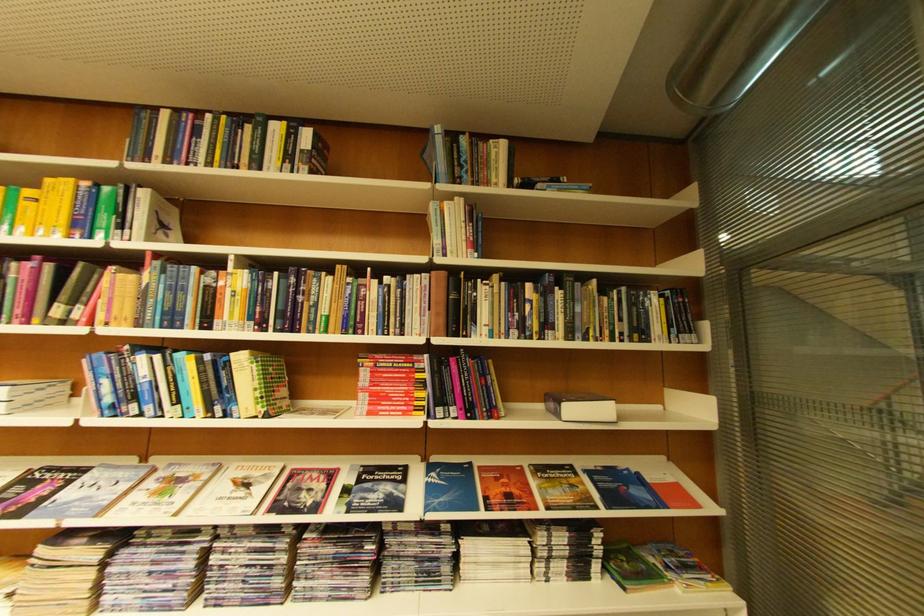
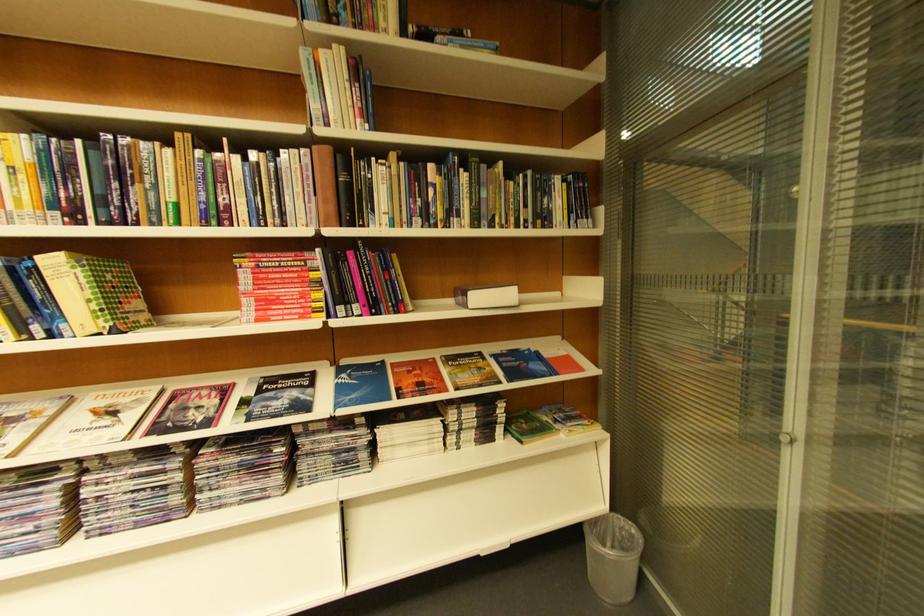
Where in the second image is the point corresponding to the point at 574,419 from the first image?

(480, 309)